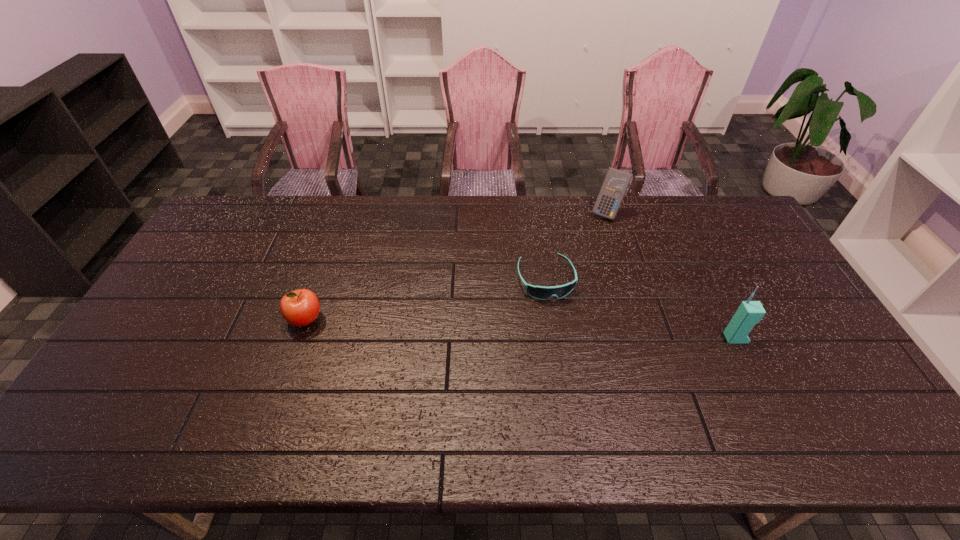
Where is `free space located 0.130m on the front-facing side of the second farthest object`? free space located 0.130m on the front-facing side of the second farthest object is located at coordinates (564, 338).

Locate an element on the screen. vacant region located 0.100m on the front-facing side of the second farthest object is located at coordinates (562, 329).

This screenshot has height=540, width=960. In order to click on blank space located 0.070m on the front-facing side of the second tallest object in this screenshot , I will do `click(599, 233)`.

Image resolution: width=960 pixels, height=540 pixels. I want to click on blank area located 0.320m on the front-facing side of the second tallest object, so click(x=581, y=282).

The height and width of the screenshot is (540, 960). Identify the location of free space located on the front-facing side of the second tallest object. (594, 246).

The width and height of the screenshot is (960, 540). I want to click on object present at the far edge, so click(x=616, y=182).

In the image, there is a desktop. Identify the location of free space at the far edge. This screenshot has height=540, width=960. (447, 222).

Locate an element on the screen. This screenshot has height=540, width=960. vacant region at the near edge of the desktop is located at coordinates (498, 402).

The image size is (960, 540). Find the location of `free location at the left edge`. free location at the left edge is located at coordinates (147, 320).

At what (x,y) coordinates should I click in order to perform the action: click on free space at the right edge of the desktop. Please return your answer as a coordinate pair (x, y). Looking at the image, I should click on (770, 316).